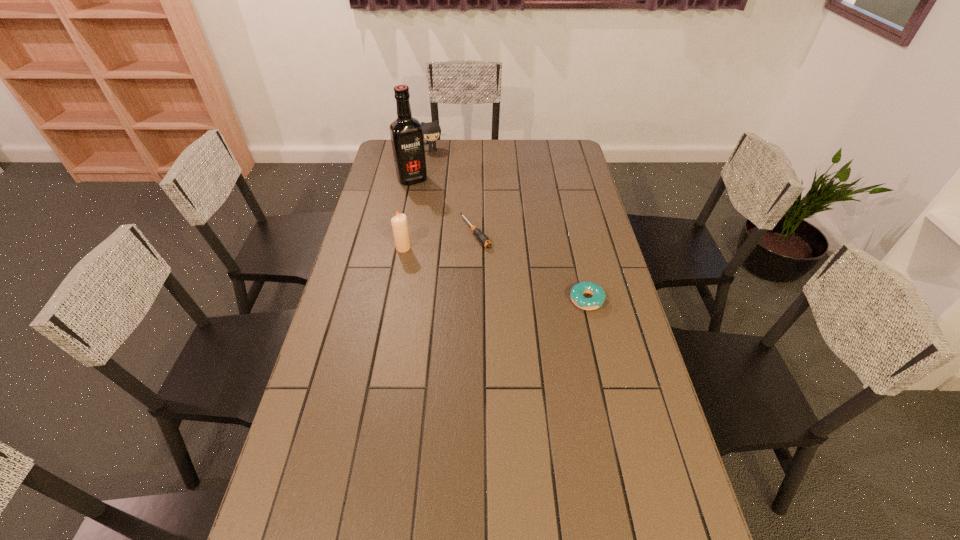
Image resolution: width=960 pixels, height=540 pixels. In order to click on candle that is at the left edge in this screenshot , I will do `click(399, 223)`.

Image resolution: width=960 pixels, height=540 pixels. In order to click on kitten present at the left edge in this screenshot , I will do click(431, 131).

Locate an element on the screen. This screenshot has height=540, width=960. liquor that is at the left edge is located at coordinates tap(406, 132).

You are a GUI agent. You are given a task and a screenshot of the screen. Output one action in this format:
    pyautogui.click(x=<x>, y=<y>)
    Task: Click on the object positioned at the right edge
    The width and height of the screenshot is (960, 540).
    Given the screenshot: What is the action you would take?
    click(x=577, y=291)

Identify the location of object positioned at the far left corner. (431, 131).

You are a GUI agent. You are given a task and a screenshot of the screen. Output one action in this format:
    pyautogui.click(x=<x>, y=<y>)
    Task: Click on the vacant region at the far edge
    
    Given the screenshot: What is the action you would take?
    pyautogui.click(x=541, y=159)

What are the coordinates of `free region at the near edge` in the screenshot? It's located at (372, 515).

Identify the location of vacant area at the left edge. (367, 224).

This screenshot has height=540, width=960. What are the coordinates of `vacant region at the right edge of the desktop` in the screenshot? It's located at (603, 310).

Locate an element on the screen. Image resolution: width=960 pixels, height=540 pixels. free space at the far left corner of the desktop is located at coordinates (378, 162).